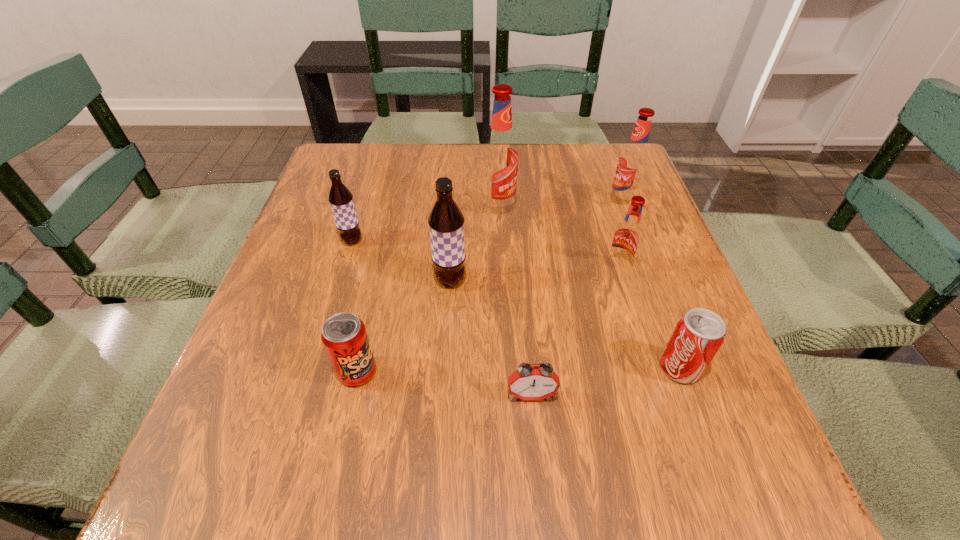
At what (x,y) coordinates should I click in order to perform the action: click on vacant area that lies between the rightmost red root beer and the fourth root beer from right to left. Please return your answer as a coordinate pair (x, y). Image resolution: width=960 pixels, height=540 pixels. Looking at the image, I should click on (536, 241).

The width and height of the screenshot is (960, 540). I want to click on empty space that is in between the second object from left to right and the farther brown root beer, so click(354, 306).

This screenshot has height=540, width=960. Identify the location of free point between the left brown root beer and the second red root beer from left to right. (485, 254).

The height and width of the screenshot is (540, 960). In order to click on vacant space that's between the rightmost root beer and the second root beer from left to right in this screenshot , I will do `click(536, 241)`.

This screenshot has height=540, width=960. What are the coordinates of `vacant point located between the left soda can and the third root beer from right to left` in the screenshot? It's located at (428, 291).

Image resolution: width=960 pixels, height=540 pixels. I want to click on blank region between the nearest red root beer and the biggest red root beer, so click(x=558, y=239).

The height and width of the screenshot is (540, 960). In order to click on free area in between the nearest red root beer and the right brown root beer in this screenshot , I will do 534,274.

I want to click on the fifth closest object to the smallest red root beer, so click(x=446, y=222).

What are the coordinates of `object that is the second closest to the rightmost root beer` in the screenshot? It's located at (499, 160).

Point out which root beer is positioned as the second nearest to the bigger brown root beer. Please provide its 2D coordinates. Your answer should be formatted as a tuple, i.e. [(x, y)], where the tuple contains the x and y coordinates of a point satisfying the conditions above.

[(340, 198)]